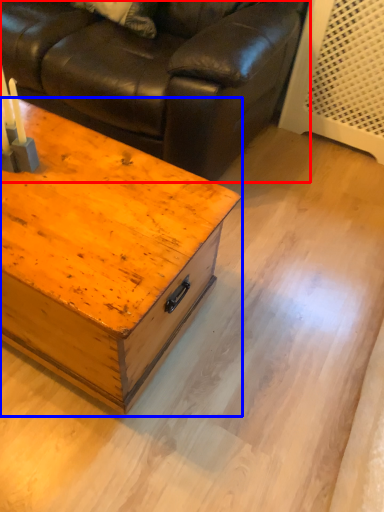
Question: Which of the following is the closest to the observer, studio couch (highlighted by a red box) or table (highlighted by a blue box)?

Choices:
 (A) studio couch
 (B) table

Answer: (B)